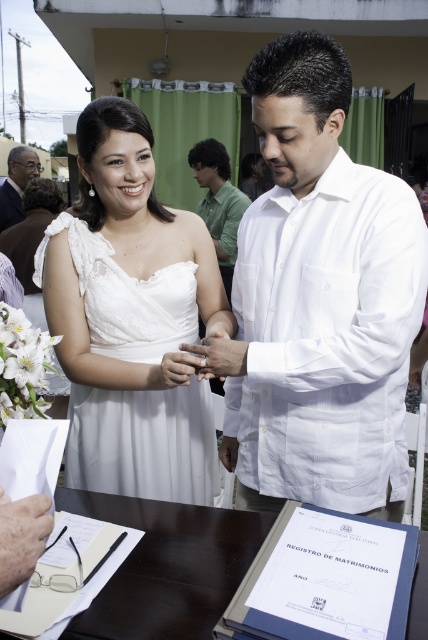
You are a photographer at the wedding and need to ensure both the green matte shirt at center and the matte black suit at left are clearly visible in the photo. Considering their widths, which one might require more careful framing to avoid being cut off?

The matte black suit at left is wider than the green matte shirt at center, so it might require more careful framing to avoid being cut off since it occupies more space in the image.

You are a photographer at the wedding ceremony. You need to position yourself so that both the white satin dress at center and the matte black suit at left are fully visible in your shot. Based on their sizes, which one might require more space in the frame?

The white satin dress at center might be wider than the matte black suit at left, so it might require more space in the frame to capture fully.